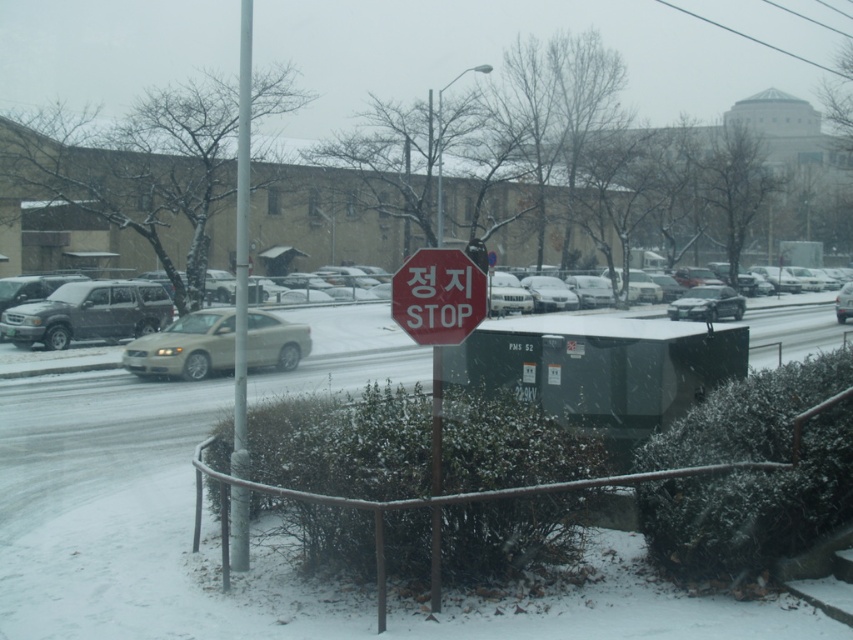
Question: Does matte gray suv at left have a greater width compared to white glossy car at center?

Choices:
 (A) yes
 (B) no

Answer: (B)

Question: Which point is closer to the camera taking this photo?

Choices:
 (A) coord(235,515)
 (B) coord(494,298)
 (C) coord(13,330)

Answer: (A)

Question: Can you confirm if red matte stop sign at center is bigger than white glossy car at center?

Choices:
 (A) no
 (B) yes

Answer: (A)

Question: From the image, what is the correct spatial relationship of red matte stop sign at center in relation to white glossy car at center?

Choices:
 (A) left
 (B) right

Answer: (A)

Question: Which point is closer to the camera?

Choices:
 (A) (468, 262)
 (B) (76, 326)

Answer: (A)

Question: Among these points, which one is nearest to the camera?

Choices:
 (A) (135, 333)
 (B) (601, 292)
 (C) (424, 333)
 (D) (166, 339)

Answer: (C)